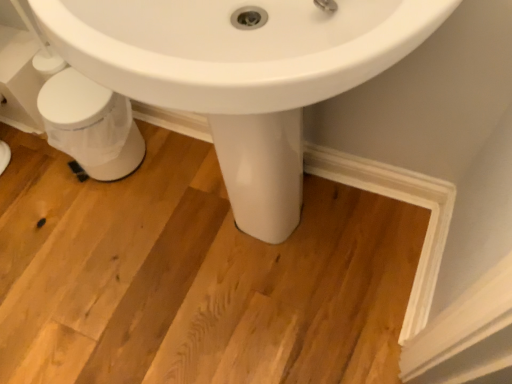
Find the location of a particular element. The image size is (512, 384). vacant area that lies between white glossy sink at center and white plastic trash can at lower left is located at coordinates (145, 189).